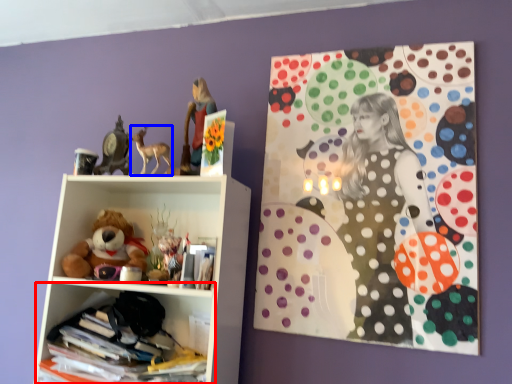
Question: Which point is further to the camera, shelf (highlighted by a red box) or animal (highlighted by a blue box)?

Choices:
 (A) shelf
 (B) animal

Answer: (B)